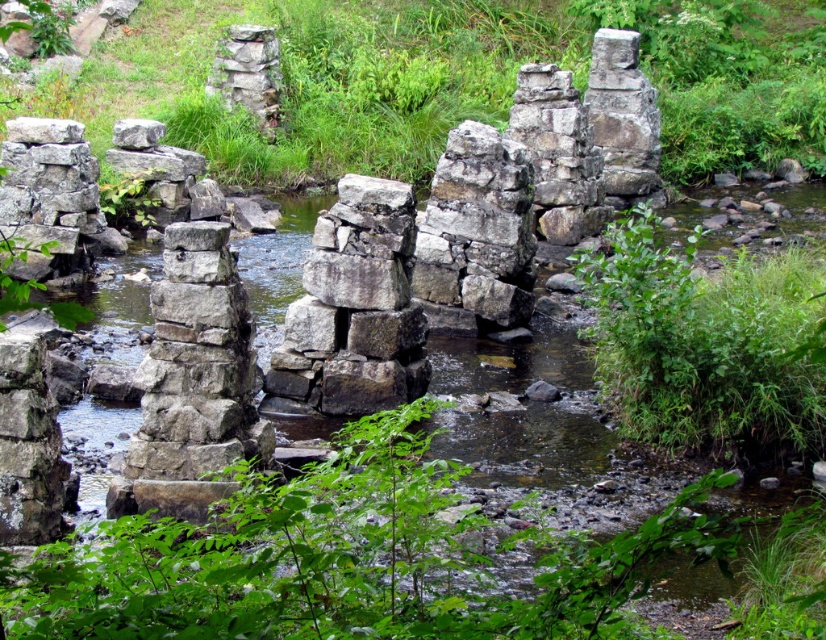
Question: Among these points, which one is nearest to the camera?

Choices:
 (A) (539, 136)
 (B) (772, 376)

Answer: (B)

Question: Does natural stone bridge at center have a lesser width compared to green leafy plant at right?

Choices:
 (A) no
 (B) yes

Answer: (A)

Question: Is natural stone bridge at center wider than green leafy plant at right?

Choices:
 (A) no
 (B) yes

Answer: (B)

Question: Is natural stone bridge at center further to the viewer compared to green leafy plant at right?

Choices:
 (A) no
 (B) yes

Answer: (B)